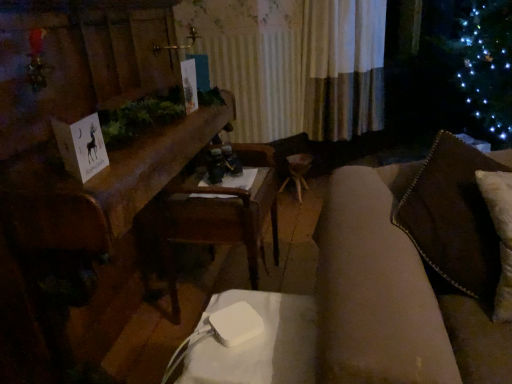
Question: Does wooden table at center appear on the right side of white paper card at left?

Choices:
 (A) no
 (B) yes

Answer: (A)

Question: Can you confirm if wooden table at center is bigger than white paper card at left?

Choices:
 (A) yes
 (B) no

Answer: (A)

Question: Is wooden table at center at the left side of white paper card at left?

Choices:
 (A) yes
 (B) no

Answer: (A)

Question: Is wooden table at center far away from white paper card at left?

Choices:
 (A) yes
 (B) no

Answer: (B)

Question: From the image's perspective, is wooden table at center located above white paper card at left?

Choices:
 (A) no
 (B) yes

Answer: (A)

Question: Is wooden table at center not inside white paper card at left?

Choices:
 (A) yes
 (B) no

Answer: (A)

Question: From a real-world perspective, is wooden armchair at center physically below white paper card at left?

Choices:
 (A) yes
 (B) no

Answer: (A)

Question: Considering the relative sizes of wooden armchair at center and white paper card at left in the image provided, is wooden armchair at center shorter than white paper card at left?

Choices:
 (A) no
 (B) yes

Answer: (A)

Question: Considering the relative sizes of wooden armchair at center and white paper card at left in the image provided, is wooden armchair at center taller than white paper card at left?

Choices:
 (A) no
 (B) yes

Answer: (B)

Question: Is wooden armchair at center completely or partially outside of white paper card at left?

Choices:
 (A) yes
 (B) no

Answer: (A)

Question: Are wooden armchair at center and white paper card at left making contact?

Choices:
 (A) no
 (B) yes

Answer: (A)

Question: Is wooden armchair at center at the left side of white paper card at left?

Choices:
 (A) no
 (B) yes

Answer: (A)

Question: From the image's perspective, does wooden table at center appear higher than white plastic table at lower center?

Choices:
 (A) no
 (B) yes

Answer: (B)